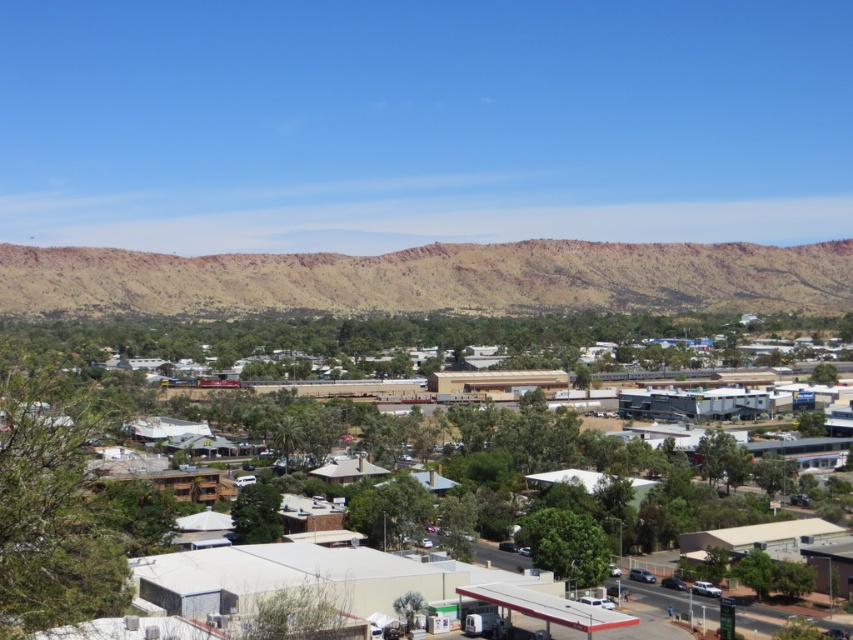
Question: Among these objects, which one is nearest to the camera?

Choices:
 (A) rustic sandstone mountain at center
 (B) white matte building at center

Answer: (B)

Question: Does rustic sandstone mountain at center appear on the left side of white matte building at center?

Choices:
 (A) no
 (B) yes

Answer: (A)

Question: Considering the relative positions of rustic sandstone mountain at center and white matte building at center in the image provided, where is rustic sandstone mountain at center located with respect to white matte building at center?

Choices:
 (A) left
 (B) right

Answer: (B)

Question: Is rustic sandstone mountain at center closer to camera compared to white matte building at center?

Choices:
 (A) yes
 (B) no

Answer: (B)